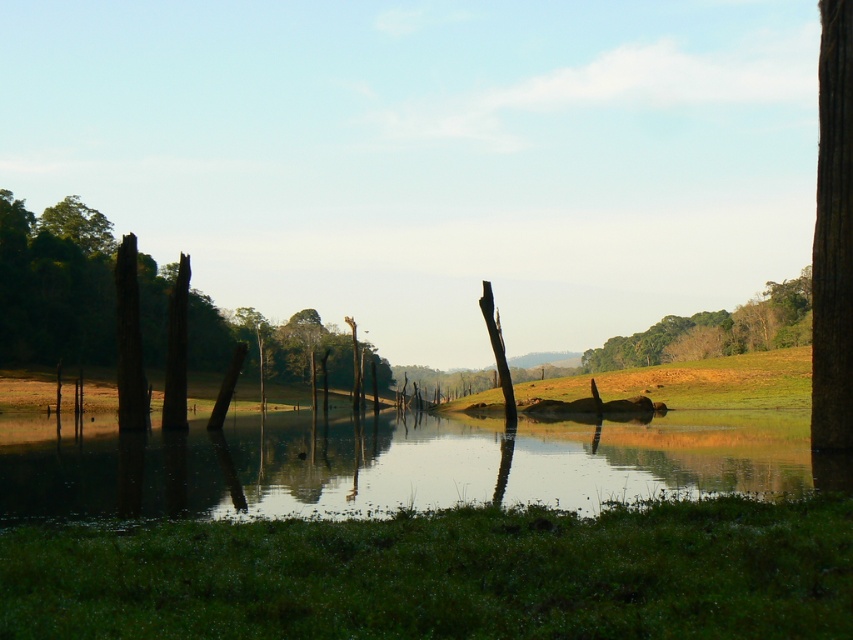
Question: Which of these objects is positioned farthest from the green leafy tree at upper left?

Choices:
 (A) green matte tree at upper center
 (B) clear water at center
 (C) smooth brown tree trunk at left

Answer: (A)

Question: Is clear water at center to the right of smooth brown tree trunk at left from the viewer's perspective?

Choices:
 (A) no
 (B) yes

Answer: (B)

Question: Which of these objects is positioned closest to the clear water at center?

Choices:
 (A) smooth brown tree trunk at left
 (B) green leafy tree at upper left
 (C) green matte tree at upper center

Answer: (A)

Question: Can you confirm if smooth brown tree trunk at left is positioned to the right of green leafy tree at upper left?

Choices:
 (A) no
 (B) yes

Answer: (B)

Question: Based on their relative distances, which object is nearer to the clear water at center?

Choices:
 (A) green matte tree at upper center
 (B) smooth brown tree trunk at left

Answer: (B)

Question: Is clear water at center bigger than smooth brown tree trunk at left?

Choices:
 (A) no
 (B) yes

Answer: (A)